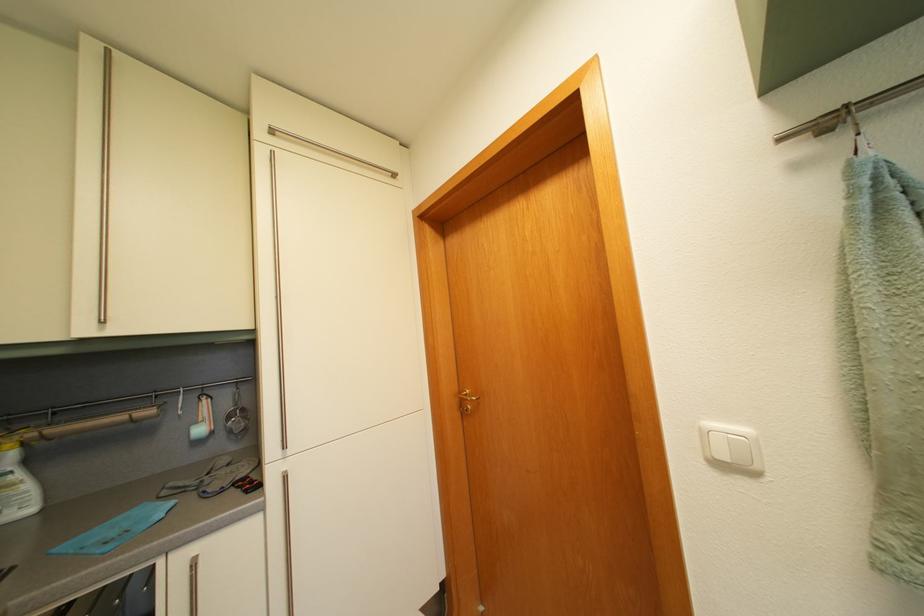
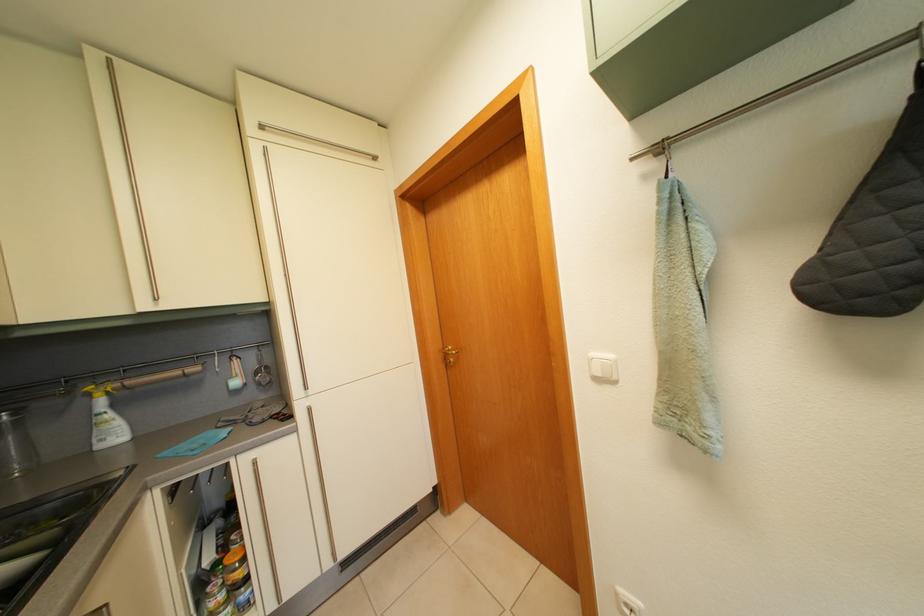
Question: How did the camera likely rotate?

Choices:
 (A) Left
 (B) Right
 (C) Up
 (D) Down

Answer: (D)